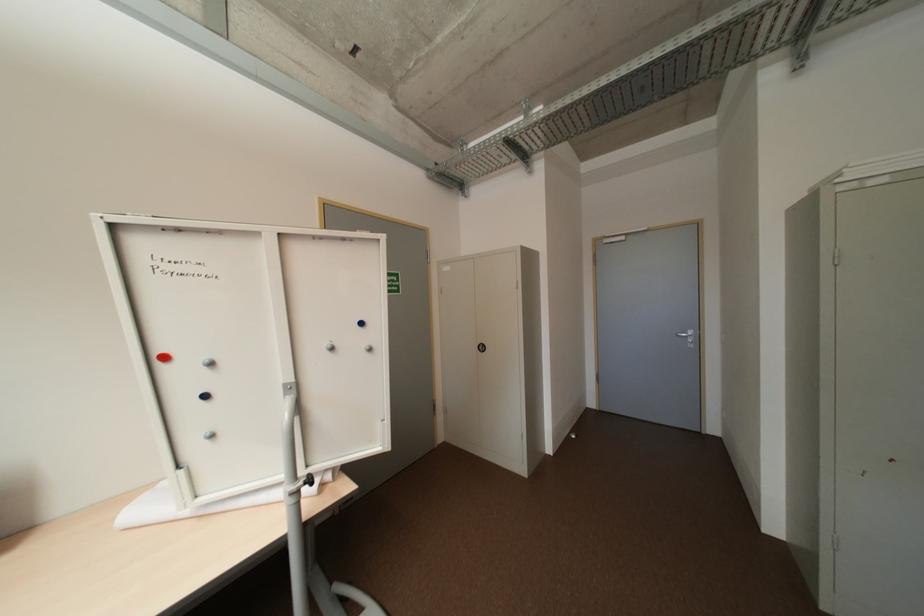
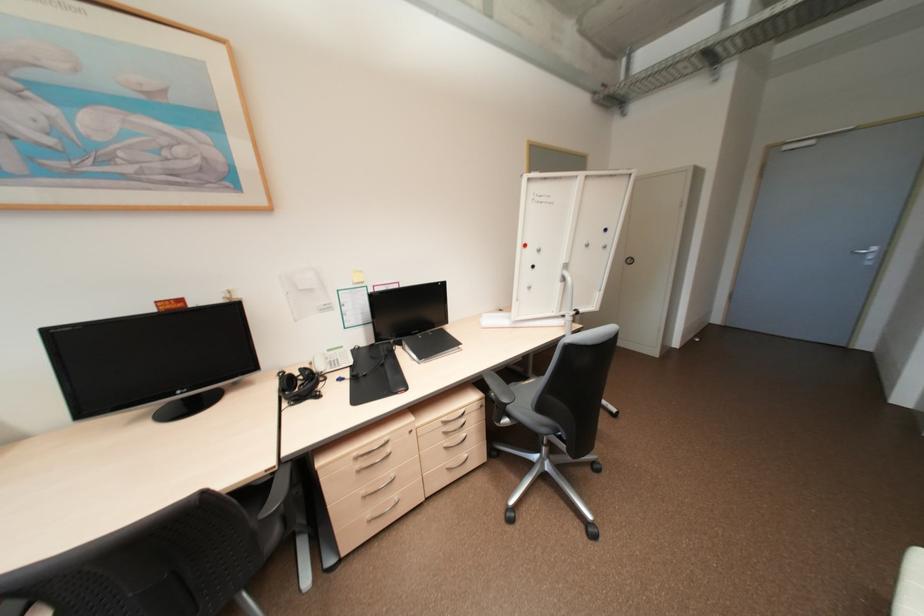
Where in the second image is the point corresponding to the point at 172,358 from the first image?

(530, 245)